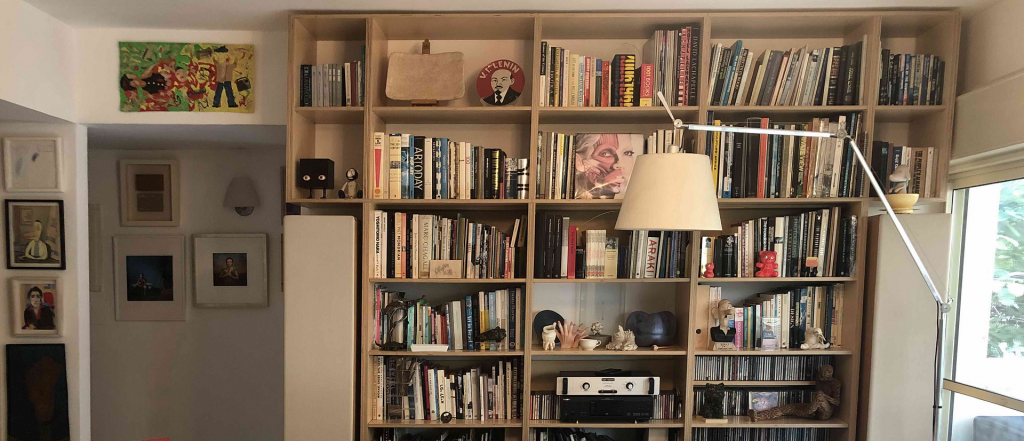
Identify the location of entryway. Image resolution: width=1024 pixels, height=441 pixels. (84, 340).